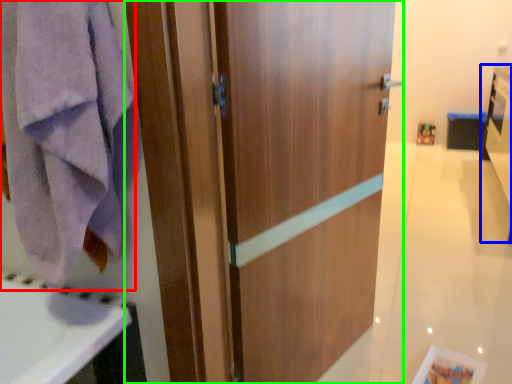
Question: Which is nearer to the towel/napkin (highlighted by a red box)? vanity (highlighted by a blue box) or door (highlighted by a green box).

Choices:
 (A) vanity
 (B) door

Answer: (B)